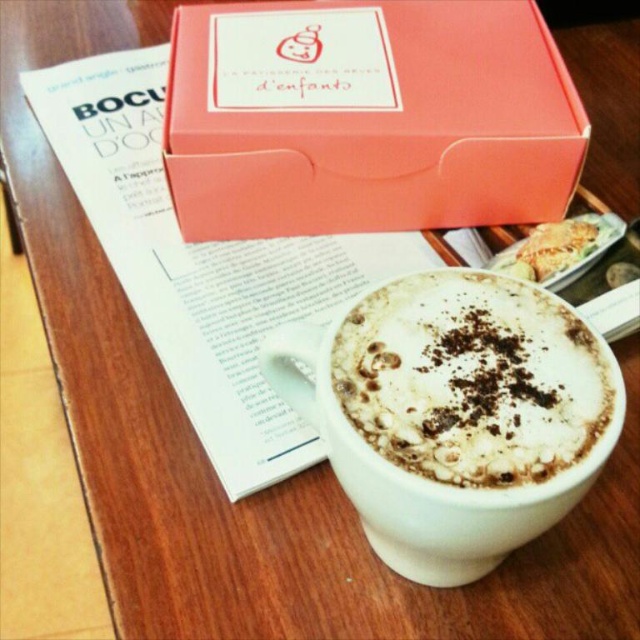
You are a barista arranging items on a table. You have a pink cardboard box at upper center and a white frothy coffee at center. According to the scene, where should you place the pink cardboard box relative to the white frothy coffee?

The pink cardboard box at upper center should be placed on the left side of the white frothy coffee at center, as it is positioned on the left side of it in the scene.

You are standing in front of a table with a white frothy coffee at center. A point is marked at coordinates (472,378). What object does this point correspond to?

The point at coordinates (472,378) corresponds to the white frothy coffee at center.